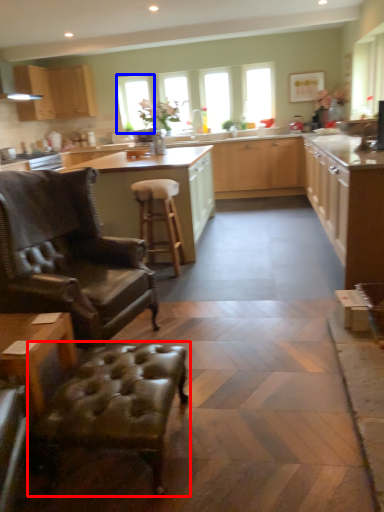
Question: Which of the following is the closest to the observer, swivel chair (highlighted by a red box) or window (highlighted by a blue box)?

Choices:
 (A) swivel chair
 (B) window

Answer: (A)